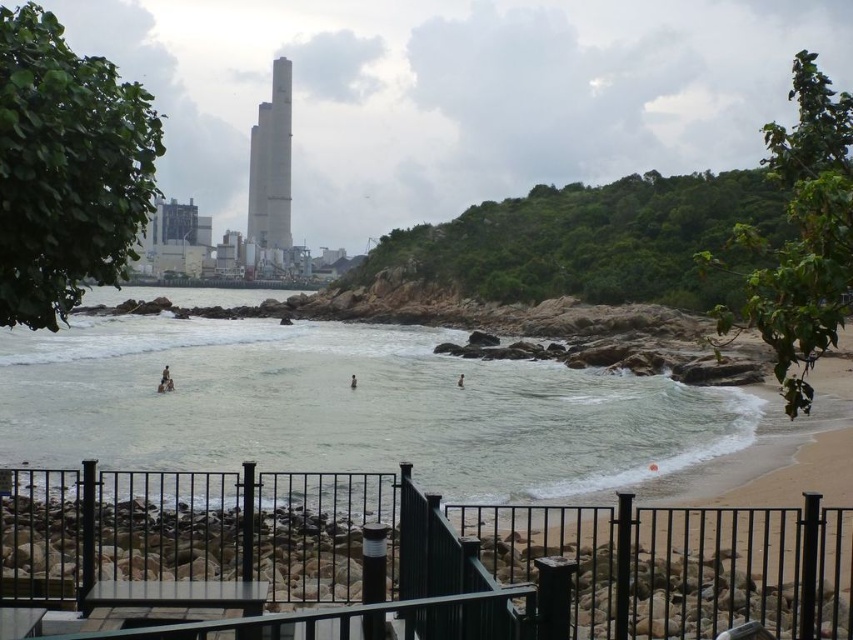
You are standing on the viewing platform with the black metal railing and want to walk to the water. You see the clear water at beach right and the brown skin at center. Which direction should you walk to reach the water first?

You should walk towards the clear water at beach right because it is positioned on the left side of brown skin at center, meaning it is closer to the water.